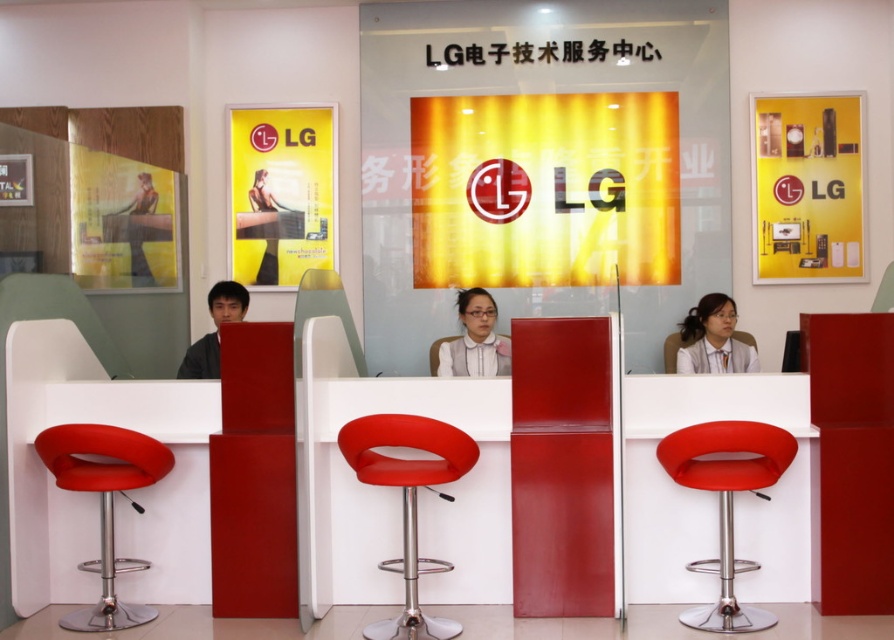
You are a customer at the LG electronics service center and you see a matte white blouse at center and a matte black shirt at left. Which one is bigger in size?

The matte white blouse at center has a larger size compared to the matte black shirt at left.